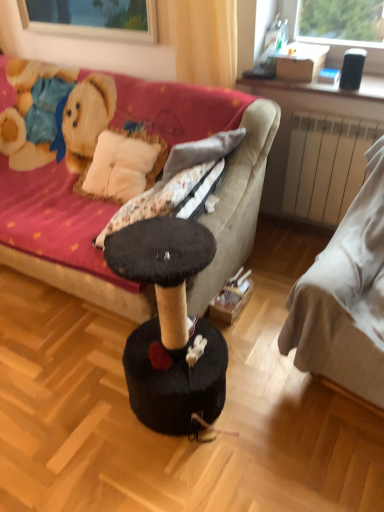
Question: Considering their positions, is velvet fabric couch at center, positioned as the first studio couch in left-to-right order, located in front of or behind white matte radiator at right?

Choices:
 (A) front
 (B) behind

Answer: (A)

Question: From a real-world perspective, relative to white matte radiator at right, is velvet fabric couch at center, which is the 2th studio couch from right to left, vertically above or below?

Choices:
 (A) below
 (B) above

Answer: (B)

Question: Estimate the real-world distances between objects in this image. Which object is farther from the transparent glass window at upper center?

Choices:
 (A) velvet fabric couch at center, which is the 2th studio couch from right to left
 (B) yellow fabric curtain at upper center
 (C) white matte radiator at right
 (D) white fabric bed at right, which is the 2th studio couch in left-to-right order

Answer: (D)

Question: Which is nearer to the velvet fabric couch at center, which is the 2th studio couch from right to left?

Choices:
 (A) white fabric bed at right, acting as the first studio couch starting from the right
 (B) yellow fabric curtain at upper center
 (C) white matte radiator at right
 (D) transparent glass window at upper center

Answer: (B)